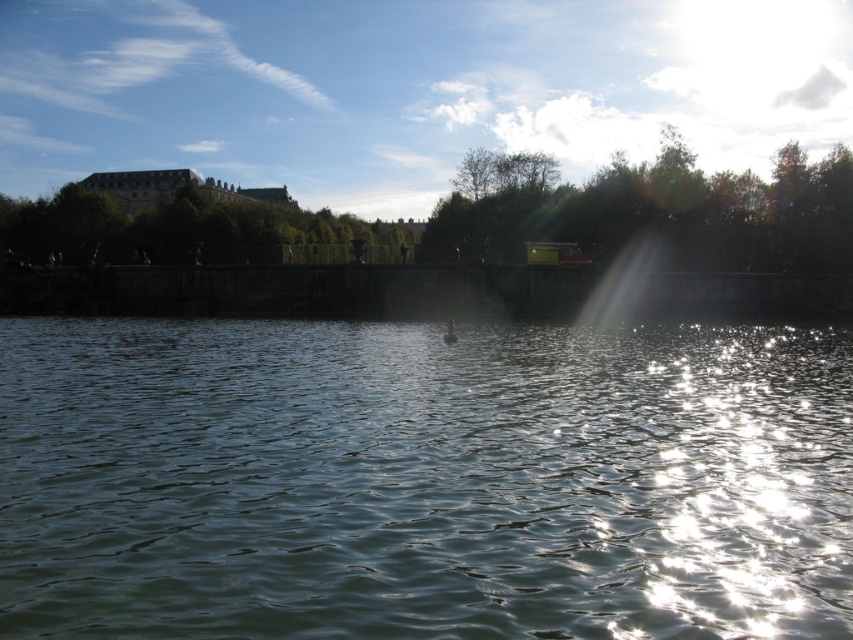
You are standing at the point marked as point (422, 481) in the image. What do you see around you?

You are standing in the clear water at center located at point (422, 481).

You are standing at the riverside and want to take a photo that includes both the green leafy tree at upper right and the green leafy tree at upper center. Based on their positions, which tree should you position closer to the top of your camera frame?

The green leafy tree at upper right should be positioned closer to the top of the camera frame because it is located above the green leafy tree at upper center.

You are a photographer planning to capture the entire riverside scene. You notice the clear water at center and the green leafy tree at upper right. Which object will appear smaller in your photo?

The clear water at center will appear smaller in the photo because it has a smaller size compared to the green leafy tree at upper right.